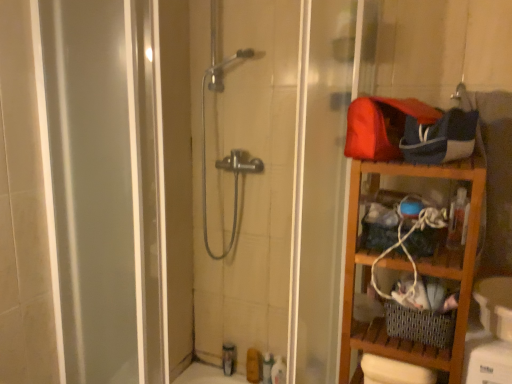
I want to click on white glossy bottle at lower center, the 4th toiletry positioned from the left, so click(x=278, y=371).

The width and height of the screenshot is (512, 384). What do you see at coordinates (267, 367) in the screenshot? I see `translucent plastic bottle at lower center, the third toiletry positioned from the left` at bounding box center [267, 367].

This screenshot has height=384, width=512. Identify the location of white glossy bottle at lower center, which is the 1th toiletry from right to left. (278, 371).

Are wooden shelf at right and white glossy bottle at lower center, which is the 1th toiletry from right to left, making contact?

They are not placed beside each other.

Could you measure the distance between wooden shelf at right and white glossy bottle at lower center, the 4th toiletry positioned from the left?

wooden shelf at right and white glossy bottle at lower center, the 4th toiletry positioned from the left, are 55.59 centimeters apart.

Considering the sizes of objects wooden shelf at right and white glossy bottle at lower center, which is the 1th toiletry from right to left, in the image provided, who is bigger, wooden shelf at right or white glossy bottle at lower center, which is the 1th toiletry from right to left,?

wooden shelf at right.

Where is `the 4th toiletry positioned below the wooden shelf at right (from the image's perspective)`? the 4th toiletry positioned below the wooden shelf at right (from the image's perspective) is located at coordinates [x=278, y=371].

How distant is translucent plastic bottle at lower center, marked as the 2th toiletry in a right-to-left arrangement, from translucent plastic toiletries at lower center, placed as the fourth toiletry when sorted from right to left?

A distance of 6.99 inches exists between translucent plastic bottle at lower center, marked as the 2th toiletry in a right-to-left arrangement, and translucent plastic toiletries at lower center, placed as the fourth toiletry when sorted from right to left.

From their relative heights in the image, would you say translucent plastic bottle at lower center, the third toiletry positioned from the left, is taller or shorter than translucent plastic toiletries at lower center, placed as the fourth toiletry when sorted from right to left?

Considering their sizes, translucent plastic bottle at lower center, the third toiletry positioned from the left, has more height than translucent plastic toiletries at lower center, placed as the fourth toiletry when sorted from right to left.

From the image's perspective, is translucent plastic bottle at lower center, marked as the 2th toiletry in a right-to-left arrangement, above or below translucent plastic toiletries at lower center, placed as the fourth toiletry when sorted from right to left?

translucent plastic bottle at lower center, marked as the 2th toiletry in a right-to-left arrangement, is below translucent plastic toiletries at lower center, placed as the fourth toiletry when sorted from right to left.

Is translucent plastic bottle at lower center, marked as the 2th toiletry in a right-to-left arrangement, looking in the opposite direction of translucent plastic toiletries at lower center, placed as the fourth toiletry when sorted from right to left?

No.

From a real-world perspective, does translucent plastic toiletries at lower center, which is counted as the 1th toiletry, starting from the left, stand above white glossy bottle at lower center, the 4th toiletry positioned from the left?

Yes, from a real-world perspective, translucent plastic toiletries at lower center, which is counted as the 1th toiletry, starting from the left, is above white glossy bottle at lower center, the 4th toiletry positioned from the left.

Does translucent plastic toiletries at lower center, placed as the fourth toiletry when sorted from right to left, have a greater width compared to white glossy bottle at lower center, the 4th toiletry positioned from the left?

No, translucent plastic toiletries at lower center, placed as the fourth toiletry when sorted from right to left, is not wider than white glossy bottle at lower center, the 4th toiletry positioned from the left.

Which point is more distant from viewer, (236, 356) or (283, 370)?

The point (236, 356) is behind.

Looking at this image, is matte brown soap at lower center, arranged as the 3th toiletry when viewed from the right, facing away from wooden shelf at right?

No, matte brown soap at lower center, arranged as the 3th toiletry when viewed from the right, is not facing the opposite direction of wooden shelf at right.

Does matte brown soap at lower center, which is counted as the 2th toiletry, starting from the left, lie behind wooden shelf at right?

Yes, matte brown soap at lower center, which is counted as the 2th toiletry, starting from the left, is further from the viewer.

Does matte brown soap at lower center, arranged as the 3th toiletry when viewed from the right, have a lesser width compared to wooden shelf at right?

Indeed, matte brown soap at lower center, arranged as the 3th toiletry when viewed from the right, has a lesser width compared to wooden shelf at right.

Based on the photo, are matte brown soap at lower center, which is counted as the 2th toiletry, starting from the left, and wooden shelf at right far apart?

Indeed, matte brown soap at lower center, which is counted as the 2th toiletry, starting from the left, is not near wooden shelf at right.

Which is behind, matte brown soap at lower center, arranged as the 3th toiletry when viewed from the right, or translucent plastic bottle at lower center, the third toiletry positioned from the left?

matte brown soap at lower center, arranged as the 3th toiletry when viewed from the right, is more distant.

Is matte brown soap at lower center, arranged as the 3th toiletry when viewed from the right, directly adjacent to translucent plastic bottle at lower center, marked as the 2th toiletry in a right-to-left arrangement?

Yes, matte brown soap at lower center, arranged as the 3th toiletry when viewed from the right, is next to translucent plastic bottle at lower center, marked as the 2th toiletry in a right-to-left arrangement.

Is matte brown soap at lower center, arranged as the 3th toiletry when viewed from the right, oriented away from translucent plastic bottle at lower center, the third toiletry positioned from the left?

matte brown soap at lower center, arranged as the 3th toiletry when viewed from the right, does not have its back to translucent plastic bottle at lower center, the third toiletry positioned from the left.

Between matte brown soap at lower center, which is counted as the 2th toiletry, starting from the left, and translucent plastic bottle at lower center, the third toiletry positioned from the left, which one has more height?

With more height is translucent plastic bottle at lower center, the third toiletry positioned from the left.

Between point (263, 368) and point (255, 365), which one is positioned in front?

The point (263, 368) is closer to the camera.

Between translucent plastic bottle at lower center, the third toiletry positioned from the left, and matte brown soap at lower center, arranged as the 3th toiletry when viewed from the right, which one has less height?

matte brown soap at lower center, arranged as the 3th toiletry when viewed from the right.

Is translucent plastic bottle at lower center, marked as the 2th toiletry in a right-to-left arrangement, outside of matte brown soap at lower center, arranged as the 3th toiletry when viewed from the right?

Yes, translucent plastic bottle at lower center, marked as the 2th toiletry in a right-to-left arrangement, is located beyond the bounds of matte brown soap at lower center, arranged as the 3th toiletry when viewed from the right.

From a real-world perspective, is translucent plastic bottle at lower center, the third toiletry positioned from the left, over matte brown soap at lower center, which is counted as the 2th toiletry, starting from the left?

Indeed, from a real-world perspective, translucent plastic bottle at lower center, the third toiletry positioned from the left, stands above matte brown soap at lower center, which is counted as the 2th toiletry, starting from the left.

Considering the relative sizes of white glossy bottle at lower center, the 4th toiletry positioned from the left, and matte brown soap at lower center, which is counted as the 2th toiletry, starting from the left, in the image provided, is white glossy bottle at lower center, the 4th toiletry positioned from the left, taller than matte brown soap at lower center, which is counted as the 2th toiletry, starting from the left,?

In fact, white glossy bottle at lower center, the 4th toiletry positioned from the left, may be shorter than matte brown soap at lower center, which is counted as the 2th toiletry, starting from the left.

Looking at their sizes, would you say white glossy bottle at lower center, which is the 1th toiletry from right to left, is wider or thinner than matte brown soap at lower center, which is counted as the 2th toiletry, starting from the left?

Clearly, white glossy bottle at lower center, which is the 1th toiletry from right to left, has more width compared to matte brown soap at lower center, which is counted as the 2th toiletry, starting from the left.

At what (x,y) coordinates should I click in order to perform the action: click on the 2nd toiletry in front when counting from the matte brown soap at lower center, which is counted as the 2th toiletry, starting from the left. Please return your answer as a coordinate pair (x, y). Looking at the image, I should click on (278, 371).

Which is more to the right, white glossy bottle at lower center, the 4th toiletry positioned from the left, or matte brown soap at lower center, arranged as the 3th toiletry when viewed from the right?

white glossy bottle at lower center, the 4th toiletry positioned from the left.

Find the location of a particular element. shelf on the right of white glossy bottle at lower center, which is the 1th toiletry from right to left is located at coordinates (416, 266).

Identify the location of toiletry that is above the translucent plastic toiletries at lower center, which is counted as the 1th toiletry, starting from the left (from a real-world perspective). (267, 367).

From the image, which object appears to be nearer to wooden shelf at right, translucent plastic bottle at lower center, marked as the 2th toiletry in a right-to-left arrangement, or white glossy bottle at lower center, which is the 1th toiletry from right to left?

The object closer to wooden shelf at right is white glossy bottle at lower center, which is the 1th toiletry from right to left.

From the image, which object appears to be nearer to translucent plastic bottle at lower center, the third toiletry positioned from the left, translucent plastic toiletries at lower center, which is counted as the 1th toiletry, starting from the left, or wooden shelf at right?

translucent plastic toiletries at lower center, which is counted as the 1th toiletry, starting from the left, is closer to translucent plastic bottle at lower center, the third toiletry positioned from the left.

Looking at the image, which one is located further to white glossy bottle at lower center, which is the 1th toiletry from right to left, translucent plastic toiletries at lower center, placed as the fourth toiletry when sorted from right to left, or matte brown soap at lower center, which is counted as the 2th toiletry, starting from the left?

Based on the image, translucent plastic toiletries at lower center, placed as the fourth toiletry when sorted from right to left, appears to be further to white glossy bottle at lower center, which is the 1th toiletry from right to left.

When comparing their distances from wooden shelf at right, does translucent plastic bottle at lower center, marked as the 2th toiletry in a right-to-left arrangement, or matte brown soap at lower center, arranged as the 3th toiletry when viewed from the right, seem closer?

translucent plastic bottle at lower center, marked as the 2th toiletry in a right-to-left arrangement.

Considering their positions, is translucent plastic toiletries at lower center, which is counted as the 1th toiletry, starting from the left, positioned closer to translucent plastic bottle at lower center, marked as the 2th toiletry in a right-to-left arrangement, than white glossy bottle at lower center, which is the 1th toiletry from right to left?

The object closer to translucent plastic bottle at lower center, marked as the 2th toiletry in a right-to-left arrangement, is translucent plastic toiletries at lower center, which is counted as the 1th toiletry, starting from the left.

Estimate the real-world distances between objects in this image. Which object is further from wooden shelf at right, white glossy bottle at lower center, the 4th toiletry positioned from the left, or matte brown soap at lower center, which is counted as the 2th toiletry, starting from the left?

matte brown soap at lower center, which is counted as the 2th toiletry, starting from the left, lies further to wooden shelf at right than the other object.

From the image, which object appears to be farther from white glossy bottle at lower center, which is the 1th toiletry from right to left, translucent plastic toiletries at lower center, which is counted as the 1th toiletry, starting from the left, or translucent plastic bottle at lower center, marked as the 2th toiletry in a right-to-left arrangement?

translucent plastic toiletries at lower center, which is counted as the 1th toiletry, starting from the left, lies further to white glossy bottle at lower center, which is the 1th toiletry from right to left, than the other object.

Which object lies further to the anchor point wooden shelf at right, matte brown soap at lower center, arranged as the 3th toiletry when viewed from the right, or translucent plastic toiletries at lower center, which is counted as the 1th toiletry, starting from the left?

translucent plastic toiletries at lower center, which is counted as the 1th toiletry, starting from the left, is positioned further to the anchor wooden shelf at right.

Where is `toiletry situated between translucent plastic toiletries at lower center, placed as the fourth toiletry when sorted from right to left, and translucent plastic bottle at lower center, the third toiletry positioned from the left, from left to right`? toiletry situated between translucent plastic toiletries at lower center, placed as the fourth toiletry when sorted from right to left, and translucent plastic bottle at lower center, the third toiletry positioned from the left, from left to right is located at coordinates click(x=253, y=366).

You are a GUI agent. You are given a task and a screenshot of the screen. Output one action in this format:
    pyautogui.click(x=<x>, y=<y>)
    Task: Click on the toiletry between matte brown soap at lower center, which is counted as the 2th toiletry, starting from the left, and white glossy bottle at lower center, which is the 1th toiletry from right to left, in the horizontal direction
    The image size is (512, 384).
    Given the screenshot: What is the action you would take?
    pyautogui.click(x=267, y=367)

Locate an element on the screen. toiletry between wooden shelf at right and translucent plastic bottle at lower center, the third toiletry positioned from the left, from front to back is located at coordinates (278, 371).